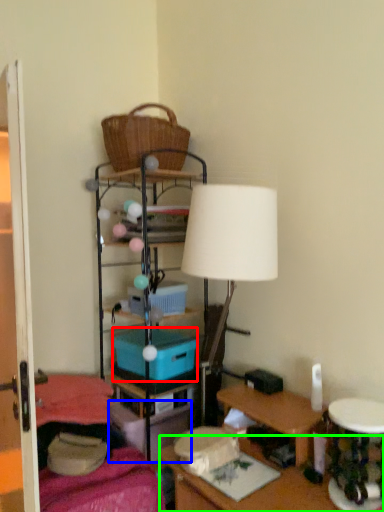
Question: Which is farther away from storage box (highlighted by a red box)? storage box (highlighted by a blue box) or desk (highlighted by a green box)?

Choices:
 (A) storage box
 (B) desk

Answer: (B)